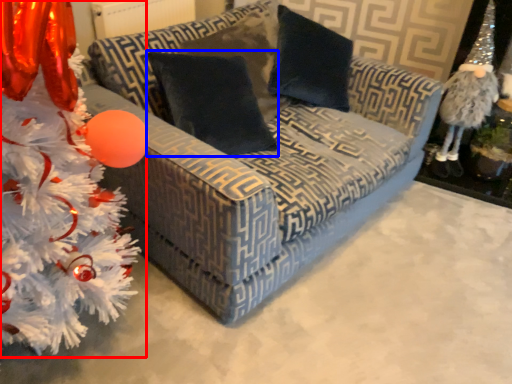
Question: Which object appears farthest to the camera in this image, christmas tree (highlighted by a red box) or pillow (highlighted by a blue box)?

Choices:
 (A) christmas tree
 (B) pillow

Answer: (B)